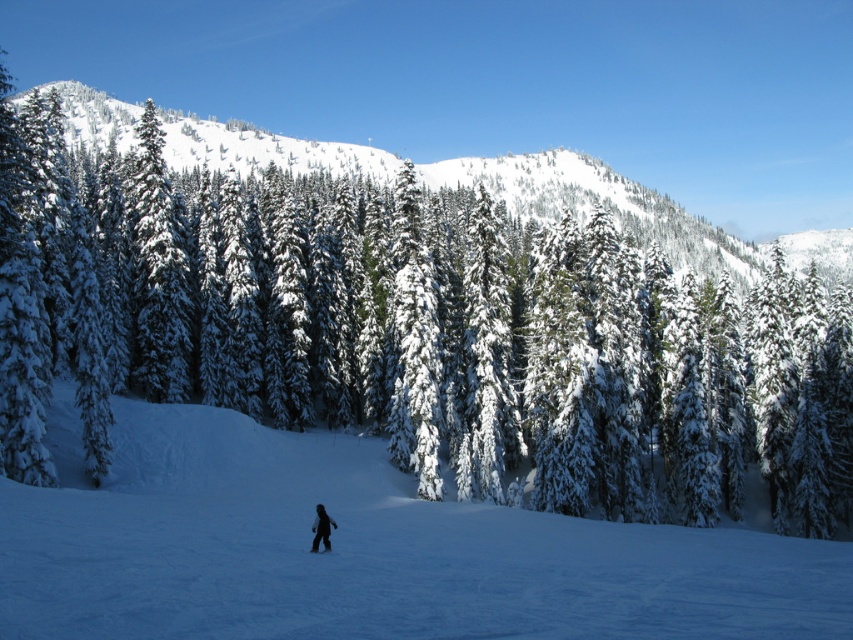
Question: Which object appears closest to the camera in this image?

Choices:
 (A) snowy pine forest at upper left
 (B) snow-covered evergreen at center

Answer: (B)

Question: Among these objects, which one is farthest from the camera?

Choices:
 (A) white snow at center
 (B) snow-covered evergreen at center
 (C) dark woolen jacket at center
 (D) snowy pine forest at upper left

Answer: (D)

Question: In this image, where is snowy pine forest at upper left located relative to dark woolen jacket at center?

Choices:
 (A) above
 (B) below

Answer: (A)

Question: From the image, what is the correct spatial relationship of snowy pine forest at upper left in relation to dark woolen jacket at center?

Choices:
 (A) right
 (B) left

Answer: (A)

Question: Considering the real-world distances, which object is closest to the snowy pine forest at upper left?

Choices:
 (A) white snow at center
 (B) dark woolen jacket at center
 (C) snow-covered evergreen at center

Answer: (C)

Question: Is snowy pine forest at upper left below black matte ski at lower center?

Choices:
 (A) yes
 (B) no

Answer: (B)